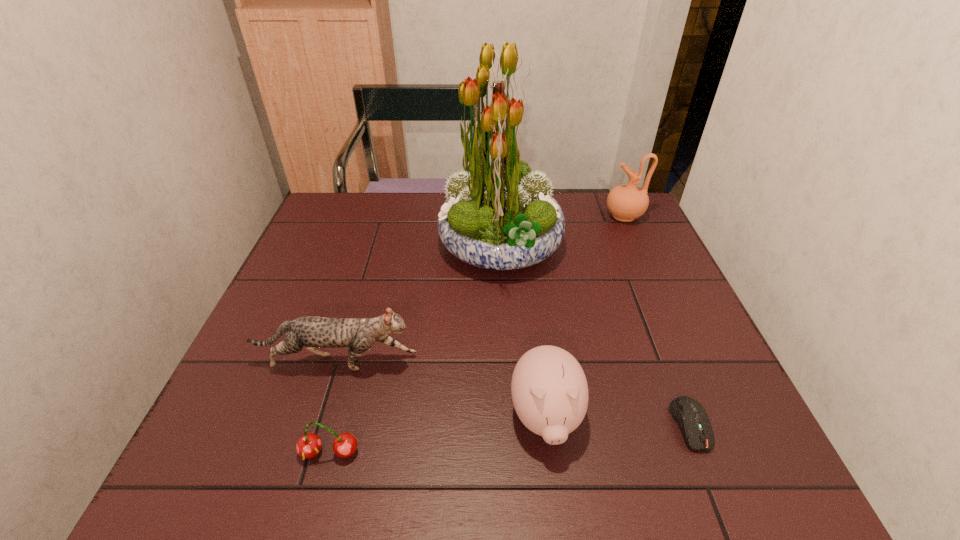
I want to click on vacant region located 0.170m on the spout of the second tallest object, so point(551,216).

I want to click on vacant area situated 0.210m on the spout of the second tallest object, so tap(539, 216).

You are a GUI agent. You are given a task and a screenshot of the screen. Output one action in this format:
    pyautogui.click(x=<x>, y=<y>)
    Task: Click on the vacant area situated on the face of the cat
    The height and width of the screenshot is (540, 960).
    Given the screenshot: What is the action you would take?
    pyautogui.click(x=586, y=363)

The image size is (960, 540). In order to click on vacant space situated on the button of the computer equipment in this screenshot , I will do `click(714, 486)`.

You are a GUI agent. You are given a task and a screenshot of the screen. Output one action in this format:
    pyautogui.click(x=<x>, y=<y>)
    Task: Click on the flower arrangement that is at the far edge
    
    Given the screenshot: What is the action you would take?
    pyautogui.click(x=498, y=215)

Find the location of `pottery located at the far edge`. pottery located at the far edge is located at coordinates (627, 202).

Find the location of `piggy bank situated at the near edge`. piggy bank situated at the near edge is located at coordinates (549, 389).

The image size is (960, 540). In order to click on cherry situated at the near edge in this screenshot , I will do `click(309, 445)`.

The width and height of the screenshot is (960, 540). In order to click on computer equipment present at the near edge in this screenshot , I will do `click(692, 419)`.

Locate an element on the screen. object that is at the left edge is located at coordinates (359, 334).